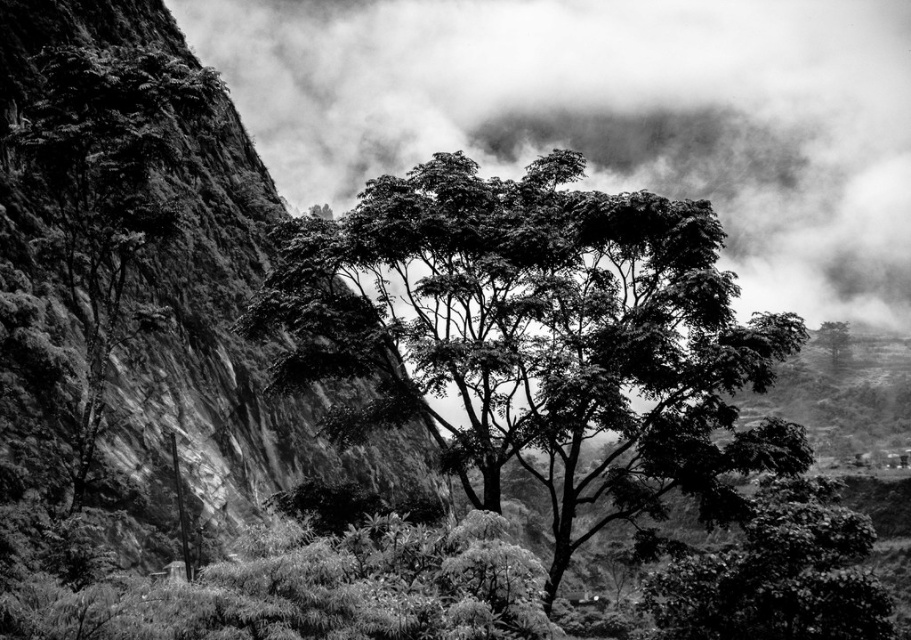
You are standing at the base of the dark green leafy tree at left and want to take a photo of it with your camera. The camera has a maximum zoom range that allows capturing details up to 50 meters away. Can you capture the tree in full detail without moving closer?

The dark green leafy tree at left and camera are 45.95 meters apart. Since the maximum zoom range is 50 meters, you can capture the tree in full detail without moving closer.

You are standing at the center of the image and want to locate the dark green leafy tree at center. What are the coordinates where you should look?

The dark green leafy tree at center is located at coordinates point (534, 336).